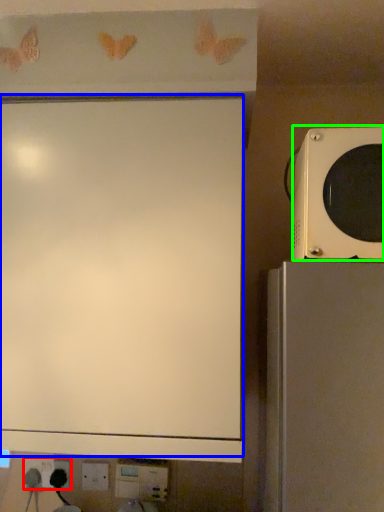
Question: Estimate the real-world distances between objects in this image. Which object is farther from electric outlet (highlighted by a red box), projection screen (highlighted by a blue box) or microwave oven (highlighted by a green box)?

Choices:
 (A) projection screen
 (B) microwave oven

Answer: (B)